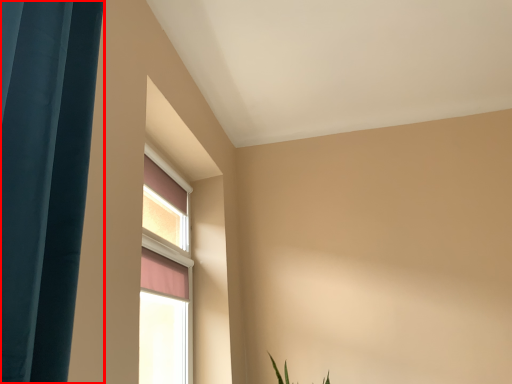
Question: Observing the image, what is the correct spatial positioning of curtain (annotated by the red box) in reference to window?

Choices:
 (A) left
 (B) right

Answer: (A)